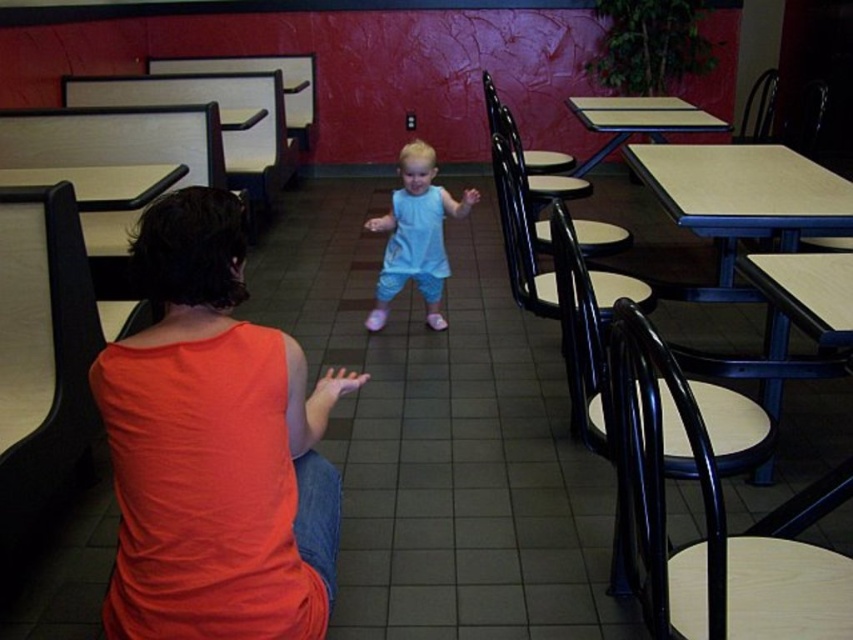
Does orange cotton tank top at center have a lesser height compared to black plastic chair at center?

Yes, orange cotton tank top at center is shorter than black plastic chair at center.

Describe the element at coordinates (213, 448) in the screenshot. I see `orange cotton tank top at center` at that location.

What do you see at coordinates (213, 448) in the screenshot? I see `orange cotton tank top at center` at bounding box center [213, 448].

Locate an element on the screen. Image resolution: width=853 pixels, height=640 pixels. orange cotton tank top at center is located at coordinates (213, 448).

Can you confirm if metallic blue chair at lower right is thinner than black plastic chair at center?

Yes, metallic blue chair at lower right is thinner than black plastic chair at center.

Can you confirm if metallic blue chair at lower right is wider than black plastic chair at center?

No, metallic blue chair at lower right is not wider than black plastic chair at center.

Identify the location of metallic blue chair at lower right. The width and height of the screenshot is (853, 640). (704, 520).

Who is positioned more to the right, black plastic chair at center or wooden table at center?

Positioned to the right is wooden table at center.

From the picture: Is black plastic chair at center positioned behind wooden table at center?

No, it is not.

Is point (611, 285) behind point (585, 163)?

No, it is not.

Where is `black plastic chair at center`? Image resolution: width=853 pixels, height=640 pixels. black plastic chair at center is located at coordinates (527, 256).